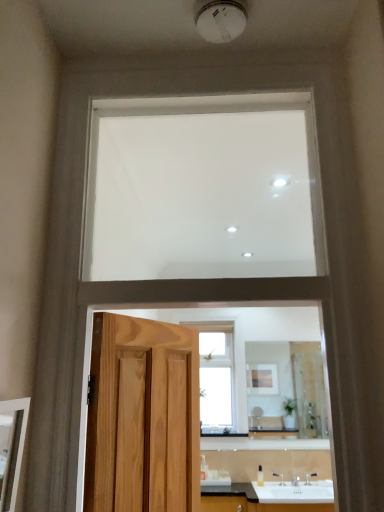
Question: Can you confirm if matte wooden mirror at left, which is the 1th mirror in left-to-right order, is taller than white glossy sink at lower center?

Choices:
 (A) no
 (B) yes

Answer: (B)

Question: Is matte wooden mirror at left, placed as the 2th mirror when sorted from bottom to top, located outside white glossy sink at lower center?

Choices:
 (A) yes
 (B) no

Answer: (A)

Question: From the image's perspective, is matte wooden mirror at left, placed as the 2th mirror when sorted from bottom to top, above white glossy sink at lower center?

Choices:
 (A) yes
 (B) no

Answer: (A)

Question: Can you confirm if matte wooden mirror at left, which is the 1th mirror in left-to-right order, is thinner than white glossy sink at lower center?

Choices:
 (A) no
 (B) yes

Answer: (B)

Question: Considering the relative sizes of matte wooden mirror at left, which is the 1th mirror in left-to-right order, and white glossy sink at lower center in the image provided, is matte wooden mirror at left, which is the 1th mirror in left-to-right order, wider than white glossy sink at lower center?

Choices:
 (A) no
 (B) yes

Answer: (A)

Question: Is matte wooden mirror at left, the first mirror from the front, aimed at white glossy sink at lower center?

Choices:
 (A) yes
 (B) no

Answer: (B)

Question: Does white matte window at upper center, the first window in the top-to-bottom sequence, appear on the left side of matte wooden mirror at left, placed as the 2th mirror when sorted from bottom to top?

Choices:
 (A) no
 (B) yes

Answer: (A)

Question: Is there a large distance between white matte window at upper center, the 1th window from the front, and matte wooden mirror at left, the first mirror from the front?

Choices:
 (A) no
 (B) yes

Answer: (B)

Question: Is white matte window at upper center, the 1th window from the front, taller than matte wooden mirror at left, the 2th mirror in the back-to-front sequence?

Choices:
 (A) no
 (B) yes

Answer: (B)

Question: Does white matte window at upper center, marked as the 2th window in a bottom-to-top arrangement, have a greater width compared to matte wooden mirror at left, placed as the 2th mirror when sorted from bottom to top?

Choices:
 (A) no
 (B) yes

Answer: (B)

Question: Is white matte window at upper center, the 1th window from the front, located outside matte wooden mirror at left, the 2th mirror in the back-to-front sequence?

Choices:
 (A) yes
 (B) no

Answer: (A)

Question: Is white matte window at upper center, marked as the 2th window in a bottom-to-top arrangement, placed right next to matte wooden mirror at left, marked as the second mirror in a right-to-left arrangement?

Choices:
 (A) yes
 (B) no

Answer: (B)

Question: Is clear glass window at center, positioned as the 1th window in back-to-front order, wider than white glossy sink at lower center?

Choices:
 (A) yes
 (B) no

Answer: (B)